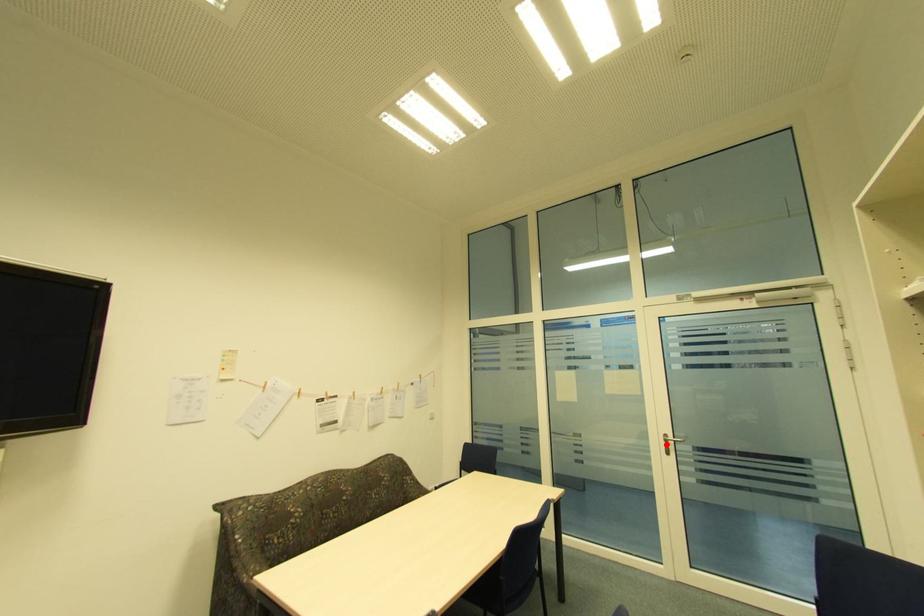
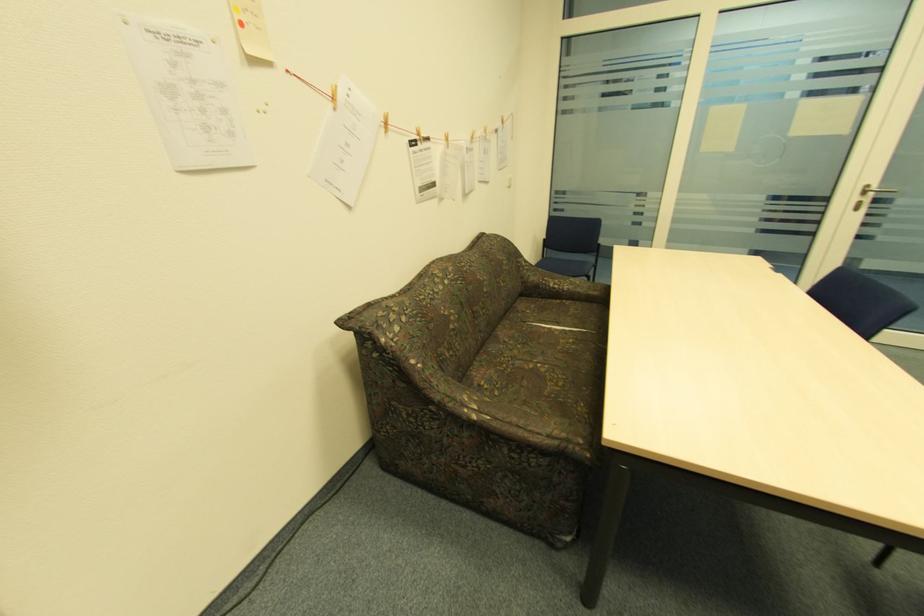
Question: I am providing you with two images of the same scene from different viewpoints. A red point is shown in image1. For the corresponding object point in image2, is it positioned nearer or farther from the camera?

Choices:
 (A) Nearer
 (B) Farther

Answer: (A)